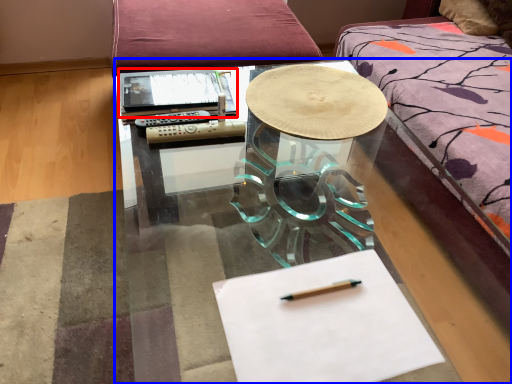
Question: Among these objects, which one is nearest to the camera, notebook (highlighted by a red box) or table (highlighted by a blue box)?

Choices:
 (A) notebook
 (B) table

Answer: (B)